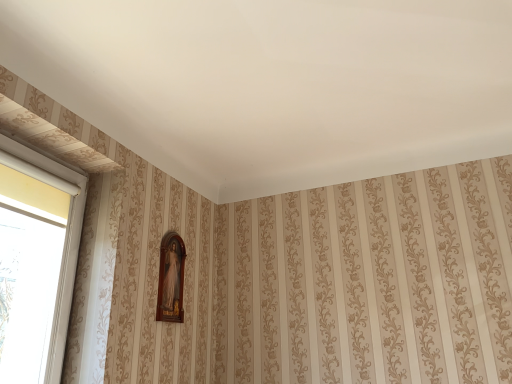
Question: Is white plastic window at left in front of or behind wooden frame at center in the image?

Choices:
 (A) front
 (B) behind

Answer: (A)

Question: Is white plastic window at left inside the boundaries of wooden frame at center, or outside?

Choices:
 (A) inside
 (B) outside

Answer: (B)

Question: From a real-world perspective, is white plastic window at left above or below wooden frame at center?

Choices:
 (A) above
 (B) below

Answer: (B)

Question: In the image, is wooden frame at center on the left side or the right side of white plastic window at left?

Choices:
 (A) right
 (B) left

Answer: (A)

Question: Considering their positions, is wooden frame at center located in front of or behind white plastic window at left?

Choices:
 (A) front
 (B) behind

Answer: (B)

Question: Which is correct: wooden frame at center is inside white plastic window at left, or outside of it?

Choices:
 (A) inside
 (B) outside

Answer: (B)

Question: From the image's perspective, is wooden frame at center positioned above or below white plastic window at left?

Choices:
 (A) below
 (B) above

Answer: (A)